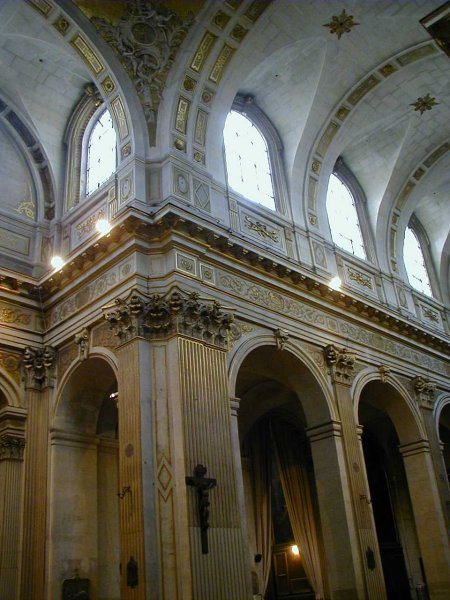
At what (x,y) coordinates should I click in order to perform the action: click on curtains. Please return your answer as a coordinate pair (x, y). The height and width of the screenshot is (600, 450). Looking at the image, I should click on (297, 503), (263, 497).